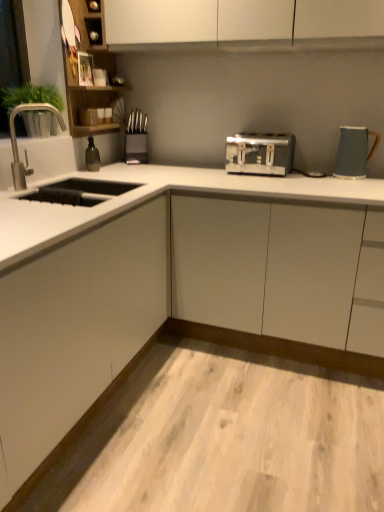
Question: Is metallic knife block at center looking in the opposite direction of white laminate countertop at lower center?

Choices:
 (A) yes
 (B) no

Answer: (B)

Question: Does metallic knife block at center have a smaller size compared to white laminate countertop at lower center?

Choices:
 (A) yes
 (B) no

Answer: (A)

Question: Considering the relative sizes of metallic knife block at center and white laminate countertop at lower center in the image provided, is metallic knife block at center bigger than white laminate countertop at lower center?

Choices:
 (A) yes
 (B) no

Answer: (B)

Question: Considering the relative sizes of metallic knife block at center and white laminate countertop at lower center in the image provided, is metallic knife block at center taller than white laminate countertop at lower center?

Choices:
 (A) yes
 (B) no

Answer: (A)

Question: From the image's perspective, is metallic knife block at center over white laminate countertop at lower center?

Choices:
 (A) no
 (B) yes

Answer: (B)

Question: Based on their positions, is silver metallic faucet at left located to the left or right of white laminate countertop at lower center?

Choices:
 (A) right
 (B) left

Answer: (B)

Question: Looking at the image, does silver metallic faucet at left seem bigger or smaller compared to white laminate countertop at lower center?

Choices:
 (A) small
 (B) big

Answer: (A)

Question: From a real-world perspective, relative to white laminate countertop at lower center, is silver metallic faucet at left vertically above or below?

Choices:
 (A) above
 (B) below

Answer: (A)

Question: Is silver metallic faucet at left in front of or behind white laminate countertop at lower center in the image?

Choices:
 (A) front
 (B) behind

Answer: (B)

Question: From a real-world perspective, is green matte plant at left positioned above or below metallic knife block at center?

Choices:
 (A) below
 (B) above

Answer: (B)

Question: Is point (1, 90) closer or farther from the camera than point (125, 160)?

Choices:
 (A) closer
 (B) farther

Answer: (A)

Question: In terms of width, does green matte plant at left look wider or thinner when compared to metallic knife block at center?

Choices:
 (A) wide
 (B) thin

Answer: (A)

Question: From their relative heights in the image, would you say green matte plant at left is taller or shorter than metallic knife block at center?

Choices:
 (A) short
 (B) tall

Answer: (B)

Question: Is satin silver toaster at center spatially inside white laminate countertop at lower center, or outside of it?

Choices:
 (A) outside
 (B) inside

Answer: (A)

Question: Considering the positions of satin silver toaster at center and white laminate countertop at lower center in the image, is satin silver toaster at center wider or thinner than white laminate countertop at lower center?

Choices:
 (A) thin
 (B) wide

Answer: (A)